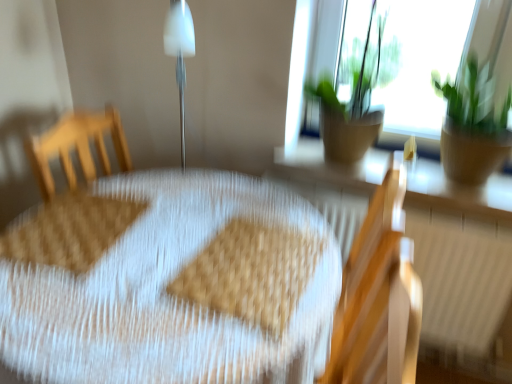
Where is `vacant region above wooden radiator at lower right (from a real-world perspective)`? vacant region above wooden radiator at lower right (from a real-world perspective) is located at coordinates (422, 206).